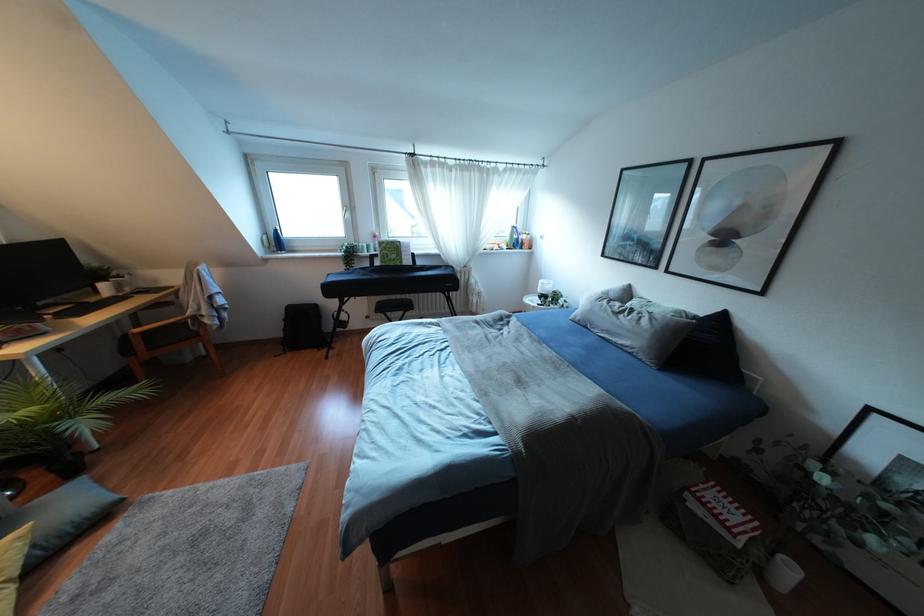
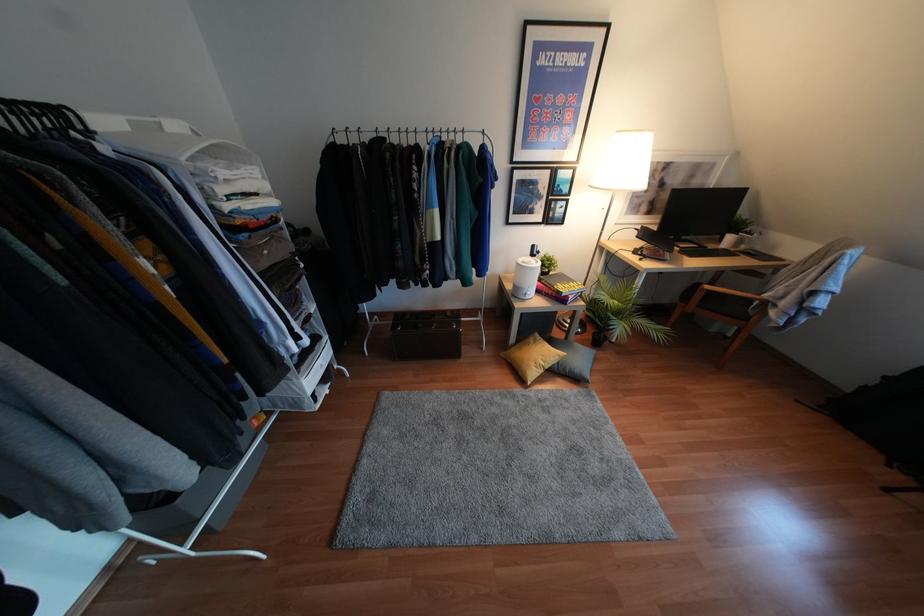
Where in the second image is the point corresponding to [135,330] from the first image?

(707, 286)